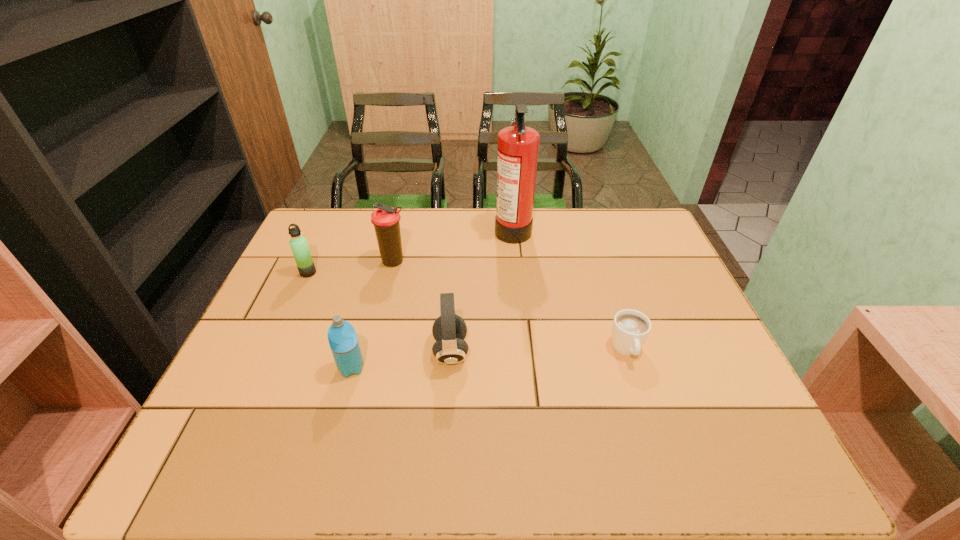
You are a GUI agent. You are given a task and a screenshot of the screen. Output one action in this format:
    pyautogui.click(x=<x>, y=<y>)
    Task: Click on the vacant space at the left edge of the desktop
    The width and height of the screenshot is (960, 540).
    Given the screenshot: What is the action you would take?
    pyautogui.click(x=320, y=260)

I want to click on vacant region at the right edge, so click(x=632, y=286).

Where is `empty location between the fire extinguisher and the fourth object from left to right`? This screenshot has height=540, width=960. empty location between the fire extinguisher and the fourth object from left to right is located at coordinates (482, 290).

Identify the location of empty space that is in between the leftmost object and the shortest object. (468, 311).

Locate an element on the screen. free area in between the leftmost thermos bottle and the nearest thermos bottle is located at coordinates (329, 320).

Identify the location of vacant space that's between the shortest object and the nearest thermos bottle. (489, 359).

At what (x,y) coordinates should I click in order to perform the action: click on vacant space that is in between the second tallest object and the fire extinguisher. Please return your answer as a coordinate pair (x, y). This screenshot has height=540, width=960. Looking at the image, I should click on (453, 245).

Identify the location of free point between the headset and the nearest thermos bottle. (401, 360).

This screenshot has width=960, height=540. Find the location of `blank region between the tallest thermos bottle and the nearest thermos bottle`. blank region between the tallest thermos bottle and the nearest thermos bottle is located at coordinates (372, 315).

The width and height of the screenshot is (960, 540). In order to click on free space between the nearest thermos bottle and the third object from right to left in this screenshot , I will do `click(401, 360)`.